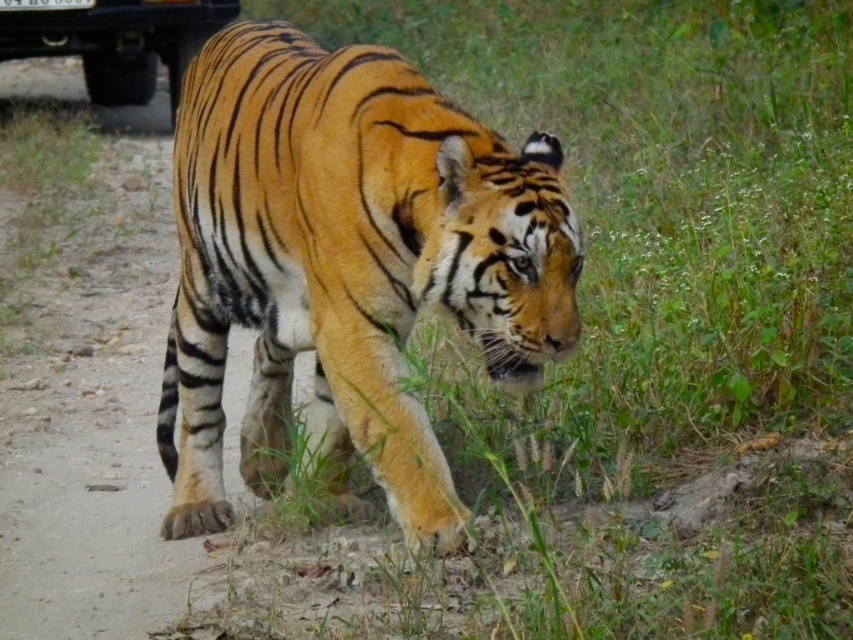
Question: Does orange striped tiger at center have a smaller size compared to metallic black truck at upper left?

Choices:
 (A) no
 (B) yes

Answer: (A)

Question: Which of the following is the farthest from the observer?

Choices:
 (A) orange striped tiger at center
 (B) metallic black truck at upper left

Answer: (B)

Question: Which of the following is the closest to the observer?

Choices:
 (A) (279, 342)
 (B) (86, 93)

Answer: (A)

Question: Among these objects, which one is farthest from the camera?

Choices:
 (A) metallic black truck at upper left
 (B) orange striped tiger at center

Answer: (A)

Question: Can you confirm if orange striped tiger at center is positioned above metallic black truck at upper left?

Choices:
 (A) no
 (B) yes

Answer: (A)

Question: Is orange striped tiger at center to the right of metallic black truck at upper left from the viewer's perspective?

Choices:
 (A) no
 (B) yes

Answer: (B)